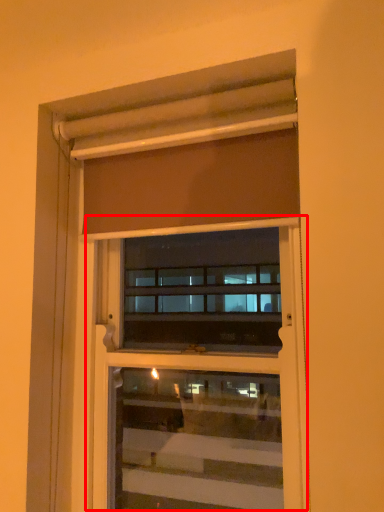
Question: From the image's perspective, where is screen door (annotated by the red box) located relative to curtain?

Choices:
 (A) below
 (B) above

Answer: (A)